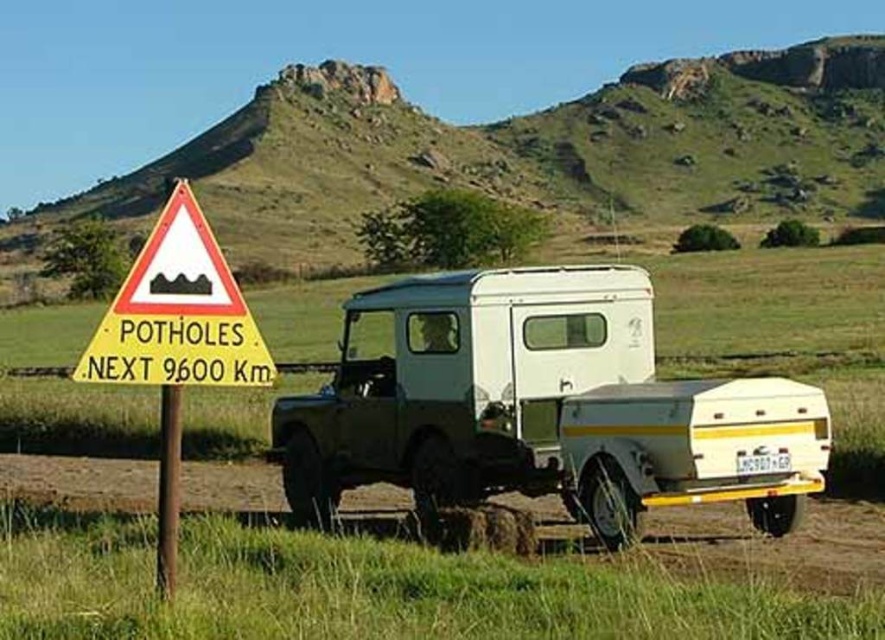
Question: Estimate the real-world distances between objects in this image. Which object is farther from the brown dirt track at lower center?

Choices:
 (A) yellow triangular sign at left
 (B) white matte recreational vehicle at center

Answer: (A)

Question: Can you confirm if white matte recreational vehicle at center is positioned to the left of yellow triangular sign at left?

Choices:
 (A) yes
 (B) no

Answer: (B)

Question: Does white matte recreational vehicle at center appear on the left side of yellow triangular sign at left?

Choices:
 (A) no
 (B) yes

Answer: (A)

Question: Observing the image, what is the correct spatial positioning of white matte recreational vehicle at center in reference to brown dirt track at lower center?

Choices:
 (A) below
 (B) above

Answer: (B)

Question: Which point appears farthest from the camera in this image?

Choices:
 (A) (525, 465)
 (B) (216, 362)

Answer: (A)

Question: Which point is farther to the camera?

Choices:
 (A) (308, 472)
 (B) (235, 294)

Answer: (A)